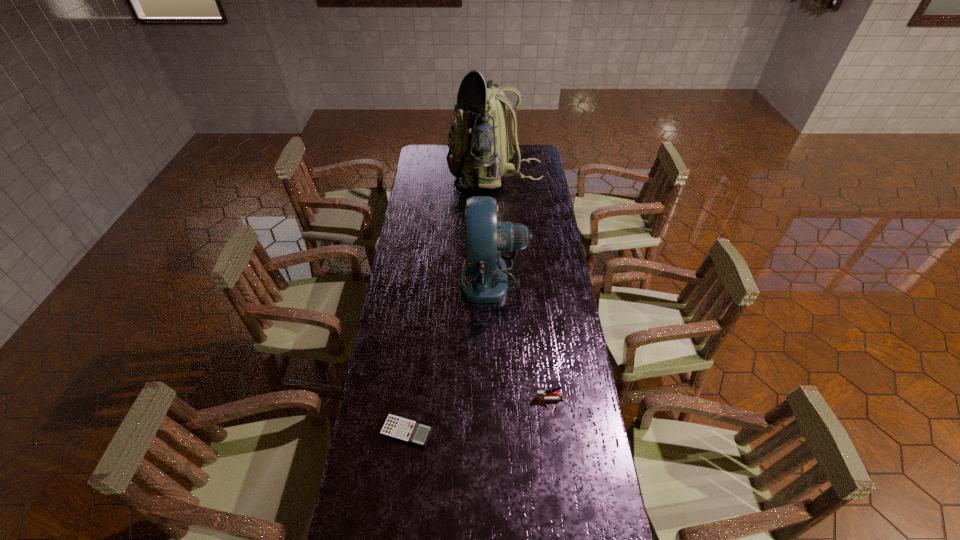
At what (x,y) coordinates should I click in order to perform the action: click on vacant area between the calculator and the stapler. Please return your answer as a coordinate pair (x, y). Looking at the image, I should click on (478, 415).

Find the location of a particular element. The width and height of the screenshot is (960, 540). free space between the second farthest object and the second shortest object is located at coordinates point(522,338).

Where is `vacant area that lies between the second nearest object and the tallest object`? vacant area that lies between the second nearest object and the tallest object is located at coordinates (522, 288).

Locate an element on the screen. vacant space in between the third shortest object and the nearest object is located at coordinates (450, 354).

You are a GUI agent. You are given a task and a screenshot of the screen. Output one action in this format:
    pyautogui.click(x=<x>, y=<y>)
    Task: Click on the object that is the second closest to the third tallest object
    This screenshot has height=540, width=960.
    Given the screenshot: What is the action you would take?
    pyautogui.click(x=484, y=279)

Point out which object is positioned as the third nearest to the fan. Please provide its 2D coordinates. Your answer should be formatted as a tuple, i.e. [(x, y)], where the tuple contains the x and y coordinates of a point satisfying the conditions above.

[(416, 433)]

Where is `free region that satisfies the following two spatial constraints: 1. in front of the third nearest object to blow air; 2. on the front side of the nearest object`? free region that satisfies the following two spatial constraints: 1. in front of the third nearest object to blow air; 2. on the front side of the nearest object is located at coordinates (498, 432).